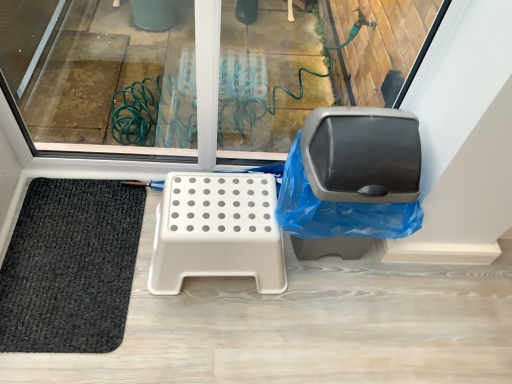
The image size is (512, 384). I want to click on free spot below black woven mat at lower left (from a real-world perspective), so click(x=74, y=251).